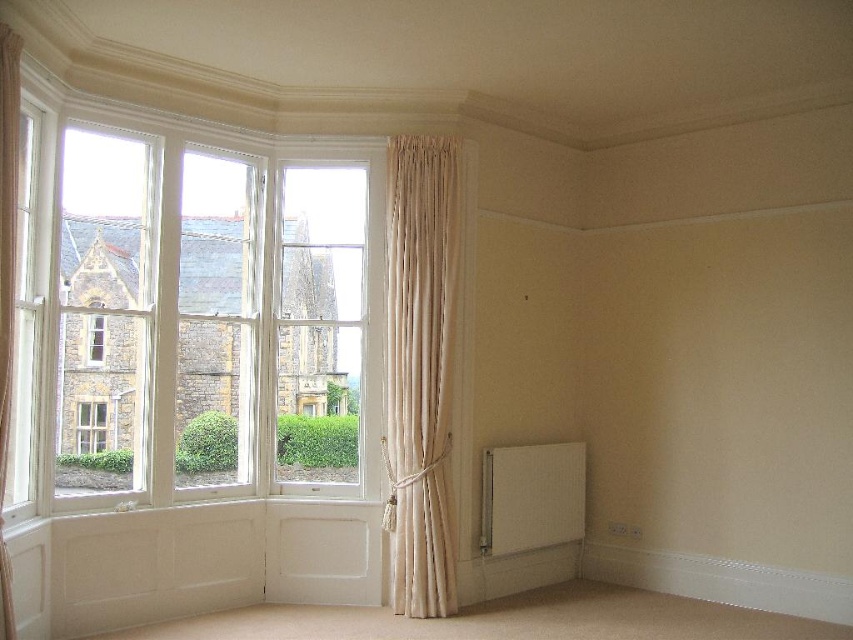
Question: Which point is farther to the camera?

Choices:
 (A) white matte radiator at lower right
 (B) beige velvet curtain at center
 (C) clear glass window at left
 (D) beige textured curtain at left

Answer: (A)

Question: Is beige velvet curtain at center to the right of white matte radiator at lower right from the viewer's perspective?

Choices:
 (A) yes
 (B) no

Answer: (B)

Question: Which is nearer to the beige velvet curtain at center?

Choices:
 (A) clear glass window at left
 (B) white matte radiator at lower right
 (C) beige textured curtain at left

Answer: (B)

Question: Is beige textured curtain at left above clear glass window at left?

Choices:
 (A) no
 (B) yes

Answer: (B)

Question: Does beige velvet curtain at center appear over clear glass window at left?

Choices:
 (A) yes
 (B) no

Answer: (B)

Question: Among these objects, which one is farthest from the camera?

Choices:
 (A) beige velvet curtain at center
 (B) beige textured curtain at left
 (C) white matte radiator at lower right

Answer: (C)